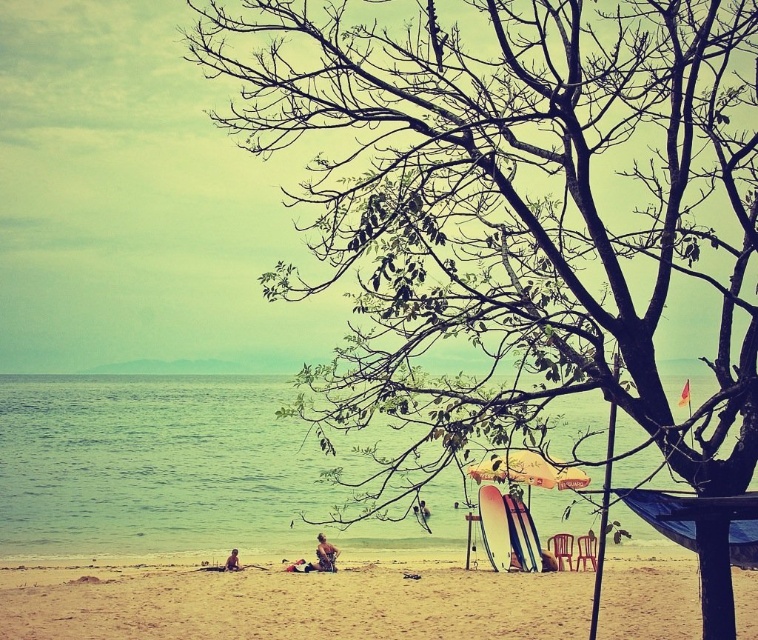
Does beige sand at lower center have a greater width compared to wooden beach chair at lower right?

No.

Is point (509, 595) positioned before point (559, 534)?

Yes, point (509, 595) is closer to viewer.

Is point (362, 625) positioned before point (562, 545)?

Yes, it is in front of point (562, 545).

Find the location of a particular element. beige sand at lower center is located at coordinates (290, 604).

Which is in front, point (691, 563) or point (503, 544)?

Point (503, 544)

Locate an element on the screen. The image size is (758, 640). beige sand at lower center is located at coordinates (290, 604).

Image resolution: width=758 pixels, height=640 pixels. Describe the element at coordinates (290, 604) in the screenshot. I see `beige sand at lower center` at that location.

You are a GUI agent. You are given a task and a screenshot of the screen. Output one action in this format:
    pyautogui.click(x=<x>, y=<y>)
    Task: Click on the beige sand at lower center
    The image size is (758, 640).
    Given the screenshot: What is the action you would take?
    pyautogui.click(x=290, y=604)

The image size is (758, 640). What are the coordinates of `metallic silver beach chair at lower right` in the screenshot? It's located at (584, 550).

Who is taller, metallic silver beach chair at lower right or tan skin person at lower left?

metallic silver beach chair at lower right

Find the location of a particular element. metallic silver beach chair at lower right is located at coordinates (584, 550).